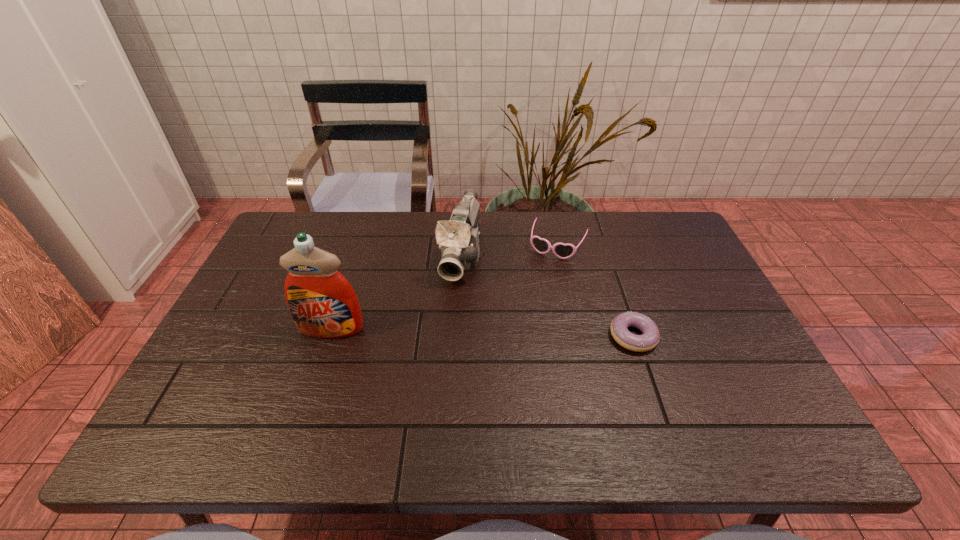
Locate an element on the screen. The height and width of the screenshot is (540, 960). detergent is located at coordinates (323, 304).

This screenshot has width=960, height=540. I want to click on the tallest object, so click(323, 304).

Find the location of a particular element. This screenshot has width=960, height=540. doughnut is located at coordinates (649, 339).

The width and height of the screenshot is (960, 540). Find the location of `the second shortest object`. the second shortest object is located at coordinates (563, 251).

The image size is (960, 540). Find the location of `camcorder`. camcorder is located at coordinates (458, 239).

In order to click on the third shortest object in this screenshot , I will do `click(458, 239)`.

Image resolution: width=960 pixels, height=540 pixels. In order to click on vacant space located on the front surface of the tallest object in this screenshot , I will do `click(316, 377)`.

The width and height of the screenshot is (960, 540). In order to click on vacant space situated on the back of the doughnut in this screenshot , I will do `click(617, 288)`.

Identify the location of free space located 0.360m on the front-facing side of the sunglasses. This screenshot has height=540, width=960. coord(509,346).

This screenshot has height=540, width=960. I want to click on vacant region located on the front-facing side of the sunglasses, so click(530, 301).